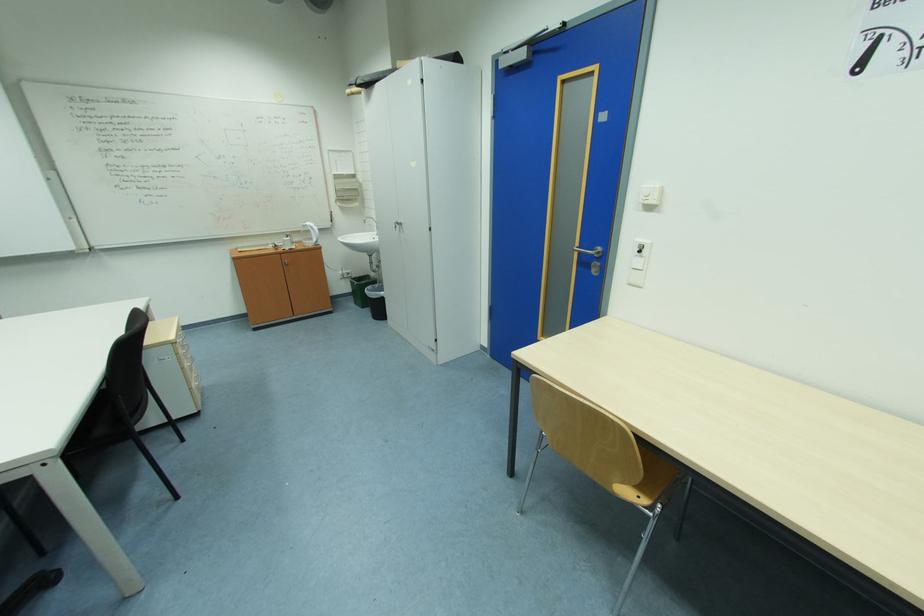
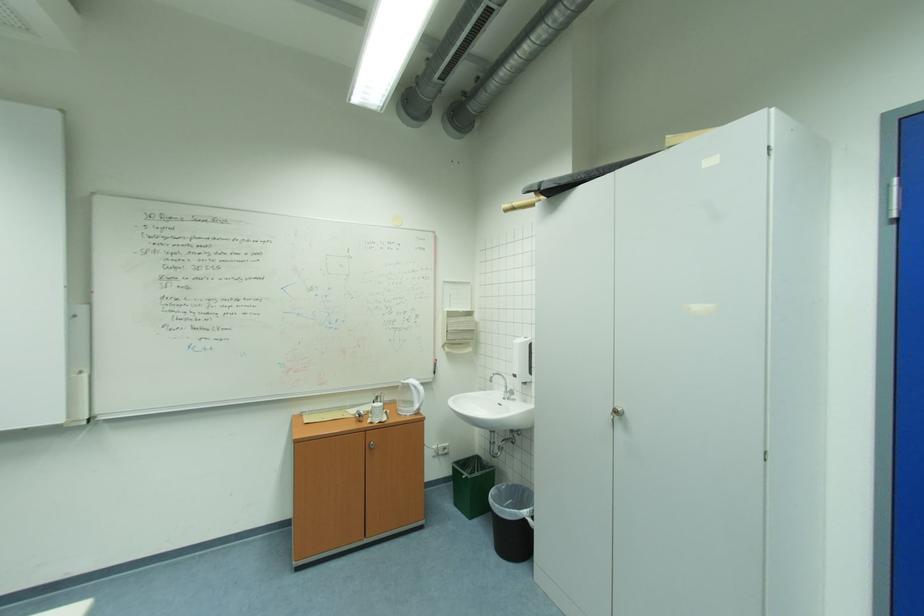
Find the pixel in the second image that matches (373,81) in the first image.

(569, 182)